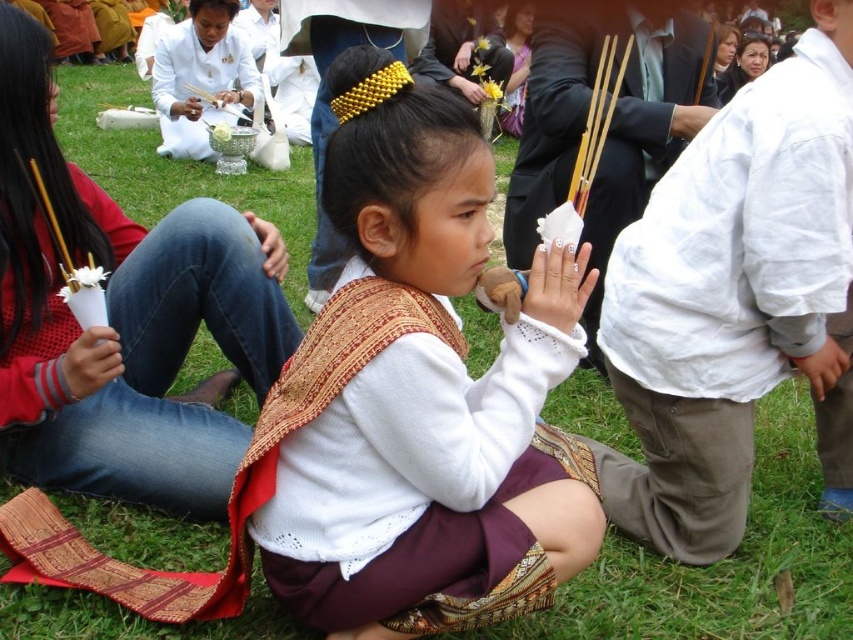
Which is in front, point (425, 628) or point (635, 528)?

Positioned in front is point (425, 628).

Is point (437, 436) farther from viewer compared to point (721, 138)?

No, (437, 436) is closer to viewer.

Based on the photo, measure the distance between matte white sweater at center and camera.

The distance of matte white sweater at center from camera is 1.49 meters.

Locate an element on the screen. This screenshot has width=853, height=640. matte white sweater at center is located at coordinates (421, 400).

Between white fabric at lower left and white cotton hand at lower right, which one has more height?

With more height is white fabric at lower left.

Who is higher up, white fabric at lower left or white cotton hand at lower right?

white fabric at lower left is above.

Does point (106, 349) lie in front of point (824, 372)?

Yes, it is.

This screenshot has height=640, width=853. In order to click on white fabric at lower left in this screenshot , I will do pyautogui.click(x=91, y=362).

Does white cotton shirt at right appear over white fabric hand at upper right?

No.

Between white cotton shirt at right and white fabric hand at upper right, which one appears on the right side from the viewer's perspective?

Positioned to the right is white fabric hand at upper right.

You are a GUI agent. You are given a task and a screenshot of the screen. Output one action in this format:
    pyautogui.click(x=<x>, y=<y>)
    Task: Click on the white cotton shirt at right
    This screenshot has height=640, width=853.
    Given the screenshot: What is the action you would take?
    click(x=728, y=292)

I want to click on white cotton shirt at right, so click(x=728, y=292).